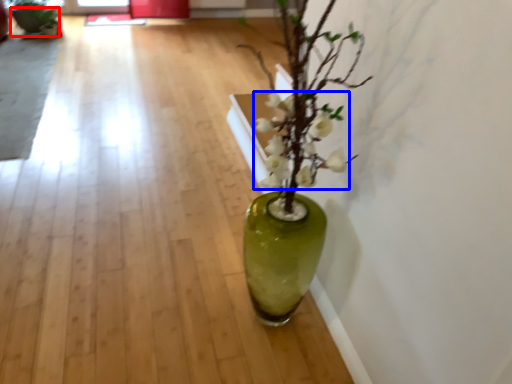
Question: Which object appears closest to the camera in this image, flowerpot (highlighted by a red box) or flower (highlighted by a blue box)?

Choices:
 (A) flowerpot
 (B) flower

Answer: (B)